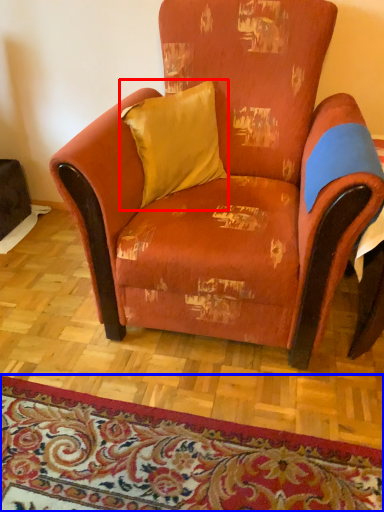
Question: Among these objects, which one is nearest to the camera, pillow (highlighted by a red box) or mat (highlighted by a blue box)?

Choices:
 (A) pillow
 (B) mat

Answer: (B)